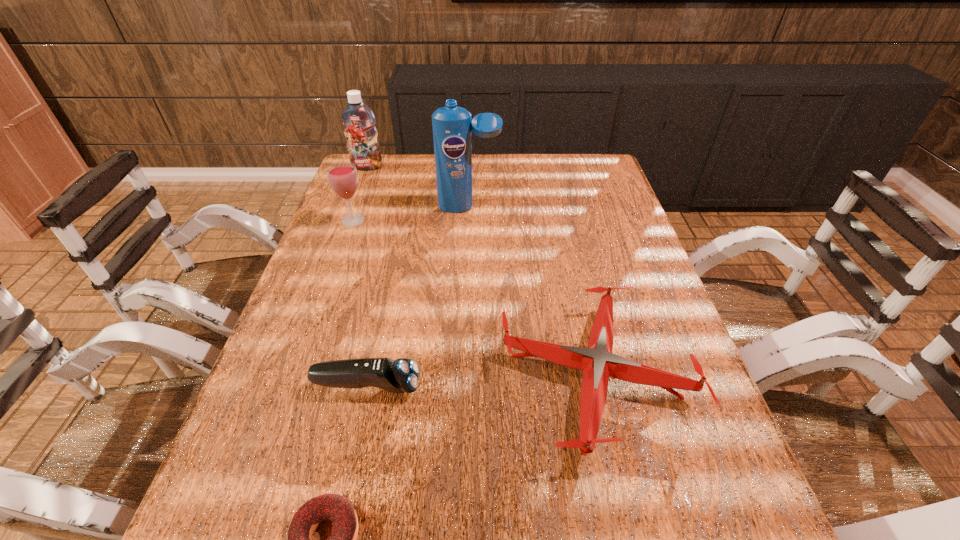
Where is `vacant position in the image that satisfies the following two spatial constraints: 1. on the front label of the drone; 2. on the right side of the farther shampoo`? Image resolution: width=960 pixels, height=540 pixels. vacant position in the image that satisfies the following two spatial constraints: 1. on the front label of the drone; 2. on the right side of the farther shampoo is located at coordinates (289, 376).

Find the location of a particular element. This screenshot has height=540, width=960. vacant space that satisfies the following two spatial constraints: 1. on the front label of the left shampoo; 2. on the right side of the wineglass is located at coordinates (347, 220).

Where is `vacant area in the image that satisfies the following two spatial constraints: 1. on the front side of the drone; 2. on the right side of the taller shampoo`? The width and height of the screenshot is (960, 540). vacant area in the image that satisfies the following two spatial constraints: 1. on the front side of the drone; 2. on the right side of the taller shampoo is located at coordinates (464, 376).